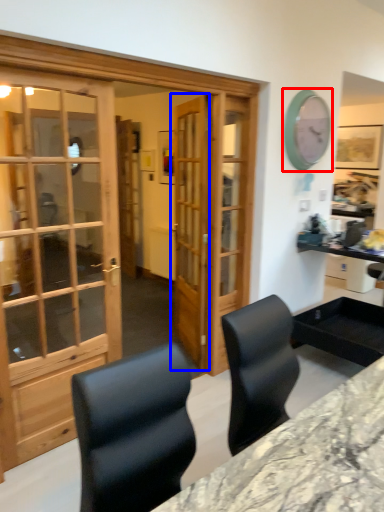
Question: Among these objects, which one is farthest to the camera, clock (highlighted by a red box) or door (highlighted by a blue box)?

Choices:
 (A) clock
 (B) door

Answer: (A)